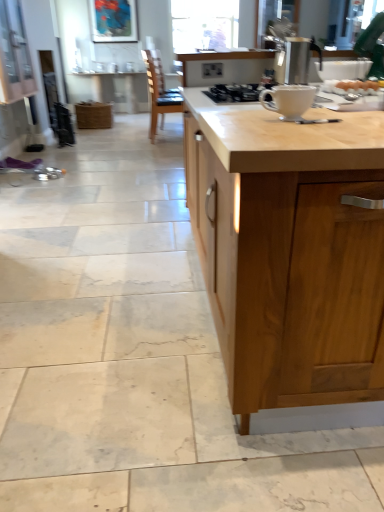
Question: From the image's perspective, is metallic silver kettle at upper right below light wood countertop at center?

Choices:
 (A) no
 (B) yes

Answer: (A)

Question: Is metallic silver kettle at upper right placed right next to light wood countertop at center?

Choices:
 (A) yes
 (B) no

Answer: (B)

Question: Is metallic silver kettle at upper right taller than light wood countertop at center?

Choices:
 (A) no
 (B) yes

Answer: (A)

Question: Could you tell me if metallic silver kettle at upper right is turned towards light wood countertop at center?

Choices:
 (A) no
 (B) yes

Answer: (B)

Question: Can you confirm if metallic silver kettle at upper right is bigger than light wood countertop at center?

Choices:
 (A) yes
 (B) no

Answer: (B)

Question: Would you say white glossy gas stove at center is to the left or to the right of metallic silver kettle at upper right in the picture?

Choices:
 (A) left
 (B) right

Answer: (A)

Question: From the image's perspective, is white glossy gas stove at center located above or below metallic silver kettle at upper right?

Choices:
 (A) below
 (B) above

Answer: (B)

Question: Is white glossy gas stove at center spatially inside metallic silver kettle at upper right, or outside of it?

Choices:
 (A) outside
 (B) inside

Answer: (A)

Question: From a real-world perspective, is white glossy gas stove at center physically located above or below metallic silver kettle at upper right?

Choices:
 (A) above
 (B) below

Answer: (B)

Question: In the image, is matte white table at center positioned in front of or behind light wood countertop at center?

Choices:
 (A) behind
 (B) front

Answer: (A)

Question: Is matte white table at center spatially inside light wood countertop at center, or outside of it?

Choices:
 (A) outside
 (B) inside

Answer: (A)

Question: From their relative heights in the image, would you say matte white table at center is taller or shorter than light wood countertop at center?

Choices:
 (A) tall
 (B) short

Answer: (B)

Question: Looking at their shapes, would you say matte white table at center is wider or thinner than light wood countertop at center?

Choices:
 (A) wide
 (B) thin

Answer: (B)

Question: Is white glossy mug at center to the left or to the right of matte white table at center in the image?

Choices:
 (A) right
 (B) left

Answer: (A)

Question: Looking at their shapes, would you say white glossy mug at center is wider or thinner than matte white table at center?

Choices:
 (A) thin
 (B) wide

Answer: (A)